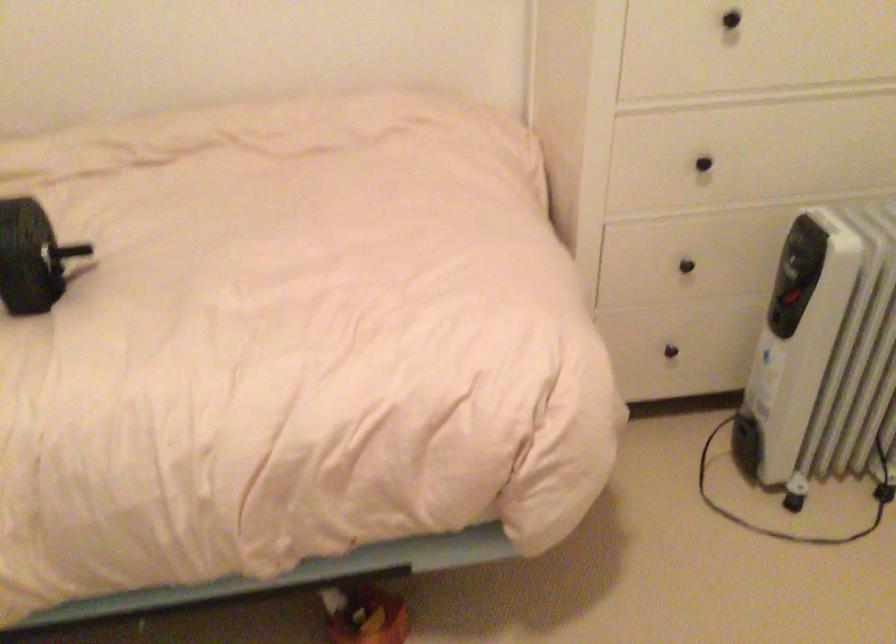
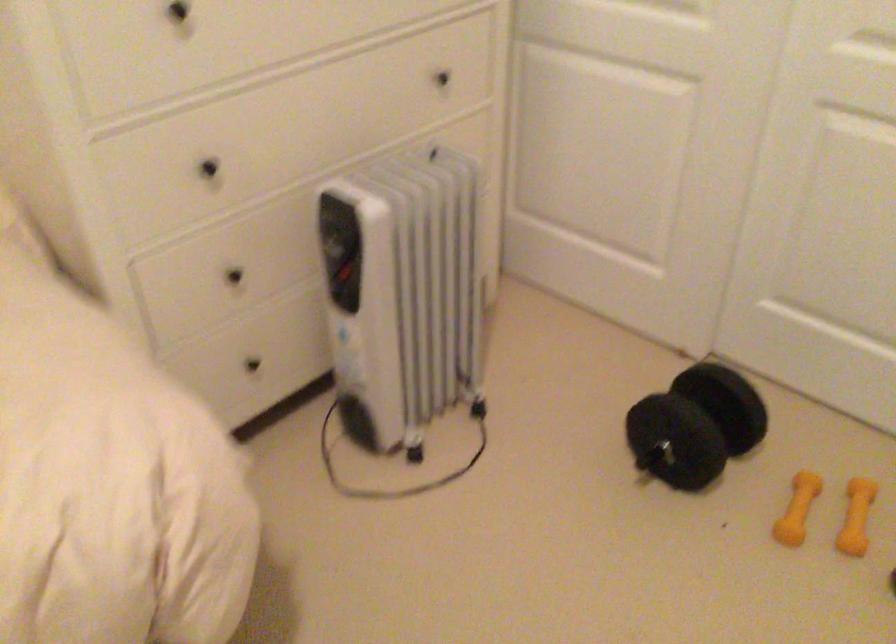
Find the pixel in the second image that matches (x=703, y=162) in the first image.

(209, 167)